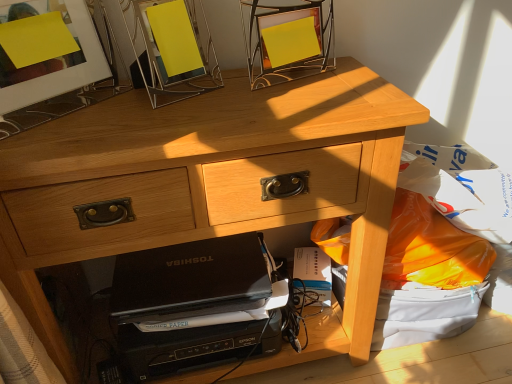
Locate an element on the screen. The width and height of the screenshot is (512, 384). white paper at lower center is located at coordinates pyautogui.click(x=314, y=272).

Where is `metallic silver picture frame at upper center, positioned as the second picture frame in left-to-right order`? This screenshot has height=384, width=512. metallic silver picture frame at upper center, positioned as the second picture frame in left-to-right order is located at coordinates (173, 50).

The image size is (512, 384). Identify the location of black matte laptop at lower center. (190, 280).

Based on the photo, is white paper at lower center spatially inside matte glass picture frame at upper left, the first picture frame in the left-to-right sequence, or outside of it?

white paper at lower center is not inside matte glass picture frame at upper left, the first picture frame in the left-to-right sequence, it's outside.

From the image's perspective, is white paper at lower center above or below matte glass picture frame at upper left, acting as the 2th picture frame starting from the right?

From the image's perspective, white paper at lower center appears below matte glass picture frame at upper left, acting as the 2th picture frame starting from the right.

Based on their sizes in the image, would you say white paper at lower center is bigger or smaller than matte glass picture frame at upper left, the first picture frame in the left-to-right sequence?

Clearly, white paper at lower center is smaller in size than matte glass picture frame at upper left, the first picture frame in the left-to-right sequence.

Is white paper at lower center aimed at matte glass picture frame at upper left, acting as the 2th picture frame starting from the right?

No, white paper at lower center does not turn towards matte glass picture frame at upper left, acting as the 2th picture frame starting from the right.

From the image's perspective, is white paper at lower center located above or below metallic silver picture frame at upper center, marked as the 1th picture frame in a right-to-left arrangement?

white paper at lower center is below metallic silver picture frame at upper center, marked as the 1th picture frame in a right-to-left arrangement.

Is point (298, 248) closer to camera compared to point (180, 47)?

No, it is not.

Looking at this image, which is behind, white paper at lower center or metallic silver picture frame at upper center, marked as the 1th picture frame in a right-to-left arrangement?

Positioned behind is white paper at lower center.

From a real-world perspective, which is physically above, matte glass picture frame at upper left, acting as the 2th picture frame starting from the right, or black matte laptop at lower center?

From a 3D spatial view, matte glass picture frame at upper left, acting as the 2th picture frame starting from the right, is above.

Based on the photo, is matte glass picture frame at upper left, acting as the 2th picture frame starting from the right, taller than black matte laptop at lower center?

Correct, matte glass picture frame at upper left, acting as the 2th picture frame starting from the right, is much taller as black matte laptop at lower center.

Is matte glass picture frame at upper left, the first picture frame in the left-to-right sequence, oriented away from black matte laptop at lower center?

No, matte glass picture frame at upper left, the first picture frame in the left-to-right sequence, is not facing the opposite direction of black matte laptop at lower center.

There is a black matte laptop at lower center. Where is `the 1st picture frame above it (from the image's perspective)`? the 1st picture frame above it (from the image's perspective) is located at coordinates [x=62, y=69].

From the image's perspective, is metallic silver picture frame at upper center, positioned as the second picture frame in left-to-right order, located above matte glass picture frame at upper left, acting as the 2th picture frame starting from the right?

Yes.

Is metallic silver picture frame at upper center, marked as the 1th picture frame in a right-to-left arrangement, smaller than matte glass picture frame at upper left, the first picture frame in the left-to-right sequence?

Correct, metallic silver picture frame at upper center, marked as the 1th picture frame in a right-to-left arrangement, occupies less space than matte glass picture frame at upper left, the first picture frame in the left-to-right sequence.

Which of these two, metallic silver picture frame at upper center, marked as the 1th picture frame in a right-to-left arrangement, or matte glass picture frame at upper left, acting as the 2th picture frame starting from the right, is thinner?

matte glass picture frame at upper left, acting as the 2th picture frame starting from the right, is thinner.

Looking at this image, from a real-world perspective, which object rests below the other?

From a 3D spatial view, matte glass picture frame at upper left, acting as the 2th picture frame starting from the right, is below.

From the image's perspective, which one is positioned lower, light wood desk at center or matte glass picture frame at upper left, acting as the 2th picture frame starting from the right?

light wood desk at center is shown below in the image.

Does light wood desk at center turn towards matte glass picture frame at upper left, the first picture frame in the left-to-right sequence?

No, light wood desk at center is not oriented towards matte glass picture frame at upper left, the first picture frame in the left-to-right sequence.

Can you confirm if light wood desk at center is shorter than matte glass picture frame at upper left, the first picture frame in the left-to-right sequence?

No.

How different are the orientations of light wood desk at center and matte glass picture frame at upper left, acting as the 2th picture frame starting from the right, in degrees?

The angular difference between light wood desk at center and matte glass picture frame at upper left, acting as the 2th picture frame starting from the right, is 44.5 degrees.

How much distance is there between black matte laptop at lower center and light wood desk at center?

A distance of 10.52 inches exists between black matte laptop at lower center and light wood desk at center.

Which point is more forward, (118, 257) or (367, 205)?

The point (367, 205) is more forward.

From a real-world perspective, which object rests below the other?

From a 3D spatial view, black matte laptop at lower center is below.

Is black matte laptop at lower center not close to light wood desk at center?

No.

Could you tell me if metallic silver picture frame at upper center, positioned as the second picture frame in left-to-right order, is facing black matte laptop at lower center?

No, metallic silver picture frame at upper center, positioned as the second picture frame in left-to-right order, is not facing towards black matte laptop at lower center.

Consider the image. Between metallic silver picture frame at upper center, marked as the 1th picture frame in a right-to-left arrangement, and black matte laptop at lower center, which one has smaller size?

Smaller between the two is black matte laptop at lower center.

Is metallic silver picture frame at upper center, positioned as the second picture frame in left-to-right order, shorter than black matte laptop at lower center?

Incorrect, the height of metallic silver picture frame at upper center, positioned as the second picture frame in left-to-right order, does not fall short of that of black matte laptop at lower center.

Is metallic silver picture frame at upper center, positioned as the second picture frame in left-to-right order, wider than black matte laptop at lower center?

Incorrect, the width of metallic silver picture frame at upper center, positioned as the second picture frame in left-to-right order, does not surpass that of black matte laptop at lower center.

Where is `paperback book behind the matte glass picture frame at upper left, the first picture frame in the left-to-right sequence`? This screenshot has height=384, width=512. paperback book behind the matte glass picture frame at upper left, the first picture frame in the left-to-right sequence is located at coordinates (314, 272).

You are a GUI agent. You are given a task and a screenshot of the screen. Output one action in this format:
    pyautogui.click(x=<x>, y=<y>)
    Task: Click on the picture frame that is the 2nd one when counting upward from the white paper at lower center (from the image's perspective)
    This screenshot has width=512, height=384.
    Given the screenshot: What is the action you would take?
    coord(173,50)

From the image, which object appears to be farther from light wood desk at center, white paper at lower center or metallic silver picture frame at upper center, positioned as the second picture frame in left-to-right order?

Among the two, white paper at lower center is located further to light wood desk at center.

Which object lies nearer to the anchor point metallic silver picture frame at upper center, positioned as the second picture frame in left-to-right order, black matte laptop at lower center or white paper at lower center?

black matte laptop at lower center lies closer to metallic silver picture frame at upper center, positioned as the second picture frame in left-to-right order, than the other object.

Based on the photo, from the image, which object appears to be nearer to matte glass picture frame at upper left, acting as the 2th picture frame starting from the right, light wood desk at center or white paper at lower center?

Among the two, light wood desk at center is located nearer to matte glass picture frame at upper left, acting as the 2th picture frame starting from the right.

Based on the photo, based on their spatial positions, is white paper at lower center or matte glass picture frame at upper left, the first picture frame in the left-to-right sequence, closer to metallic silver picture frame at upper center, marked as the 1th picture frame in a right-to-left arrangement?

Among the two, matte glass picture frame at upper left, the first picture frame in the left-to-right sequence, is located nearer to metallic silver picture frame at upper center, marked as the 1th picture frame in a right-to-left arrangement.

From the image, which object appears to be farther from metallic silver picture frame at upper center, positioned as the second picture frame in left-to-right order, matte glass picture frame at upper left, the first picture frame in the left-to-right sequence, or black matte laptop at lower center?

black matte laptop at lower center lies further to metallic silver picture frame at upper center, positioned as the second picture frame in left-to-right order, than the other object.

Based on their spatial positions, is light wood desk at center or matte glass picture frame at upper left, the first picture frame in the left-to-right sequence, further from metallic silver picture frame at upper center, positioned as the second picture frame in left-to-right order?

light wood desk at center.

Considering their positions, is black matte laptop at lower center positioned further to matte glass picture frame at upper left, the first picture frame in the left-to-right sequence, than metallic silver picture frame at upper center, positioned as the second picture frame in left-to-right order?

black matte laptop at lower center is further to matte glass picture frame at upper left, the first picture frame in the left-to-right sequence.

Which object lies nearer to the anchor point white paper at lower center, matte glass picture frame at upper left, acting as the 2th picture frame starting from the right, or black matte laptop at lower center?

black matte laptop at lower center is positioned closer to the anchor white paper at lower center.

Locate an element on the screen. Image resolution: width=512 pixels, height=384 pixels. picture frame between metallic silver picture frame at upper center, positioned as the second picture frame in left-to-right order, and white paper at lower center from top to bottom is located at coordinates (62, 69).

The width and height of the screenshot is (512, 384). Find the location of `picture frame that lies between metallic silver picture frame at upper center, positioned as the second picture frame in left-to-right order, and black matte laptop at lower center from top to bottom`. picture frame that lies between metallic silver picture frame at upper center, positioned as the second picture frame in left-to-right order, and black matte laptop at lower center from top to bottom is located at coordinates (62, 69).

Where is `desk between matte glass picture frame at upper left, the first picture frame in the left-to-right sequence, and black matte laptop at lower center in the up-down direction`? The height and width of the screenshot is (384, 512). desk between matte glass picture frame at upper left, the first picture frame in the left-to-right sequence, and black matte laptop at lower center in the up-down direction is located at coordinates (210, 186).

At what (x,y) coordinates should I click in order to perform the action: click on desk located between matte glass picture frame at upper left, acting as the 2th picture frame starting from the right, and white paper at lower center in the depth direction. Please return your answer as a coordinate pair (x, y). This screenshot has height=384, width=512. Looking at the image, I should click on (210, 186).